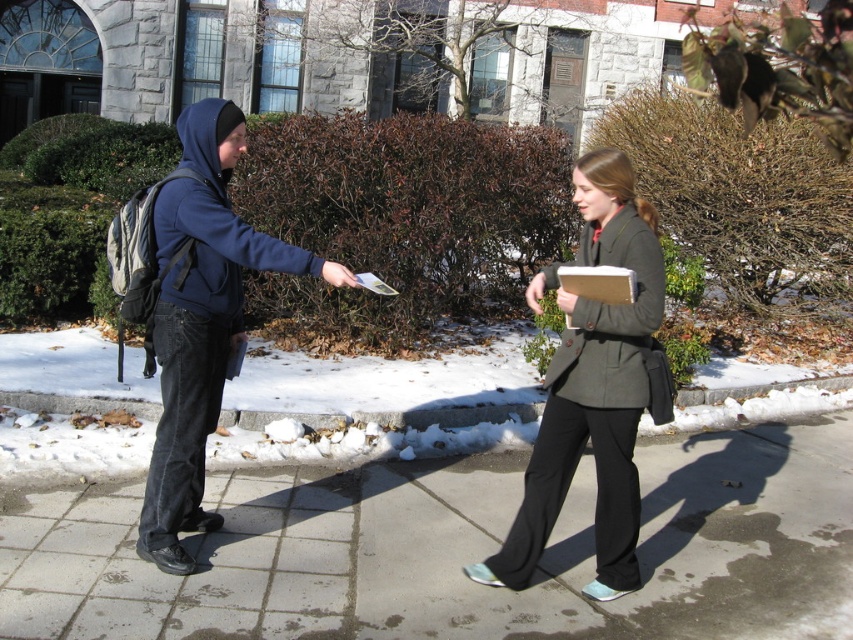
You are a delivery robot navigating a campus path. You need to pass between the concrete sidewalk at center and the matte blue hoodie at left. Can you fit through the space if your width is 0.8 meters?

The concrete sidewalk at center is wider than the matte blue hoodie at left, so the space between them allows passage for the delivery robot with a width of 0.8 meters.

You are a delivery person trying to walk across the concrete sidewalk at center while avoiding stepping on the dark gray wool coat at center. Can you walk through the area without stepping on the coat?

The concrete sidewalk at center is larger in size than dark gray wool coat at center, so yes, you can walk through the area without stepping on the coat.

You are walking on the concrete sidewalk at center and want to greet the matte blue hoodie at left. Which direction should you move to approach them?

The concrete sidewalk at center is in front of the matte blue hoodie at left, so you should move towards the left direction to approach them.